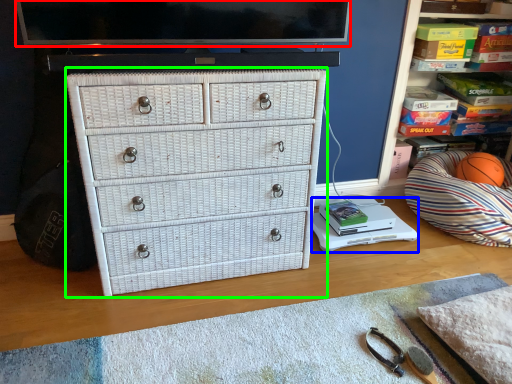
Question: Which object is the closest to the television (highlighted by a red box)? Choose among these: changing table (highlighted by a blue box) or chest of drawers (highlighted by a green box).

Choices:
 (A) changing table
 (B) chest of drawers

Answer: (B)